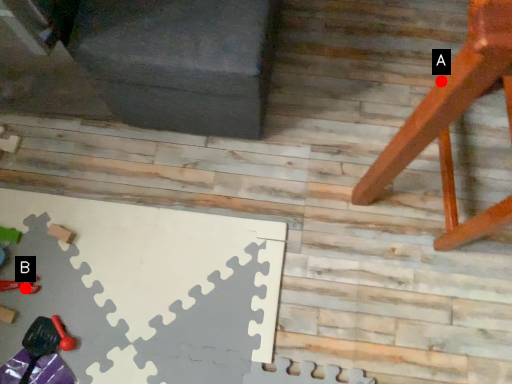
Question: Two points are circled on the image, labeled by A and B beside each circle. Which of the following is the farthest from the observer?

Choices:
 (A) A is further
 (B) B is further

Answer: (B)